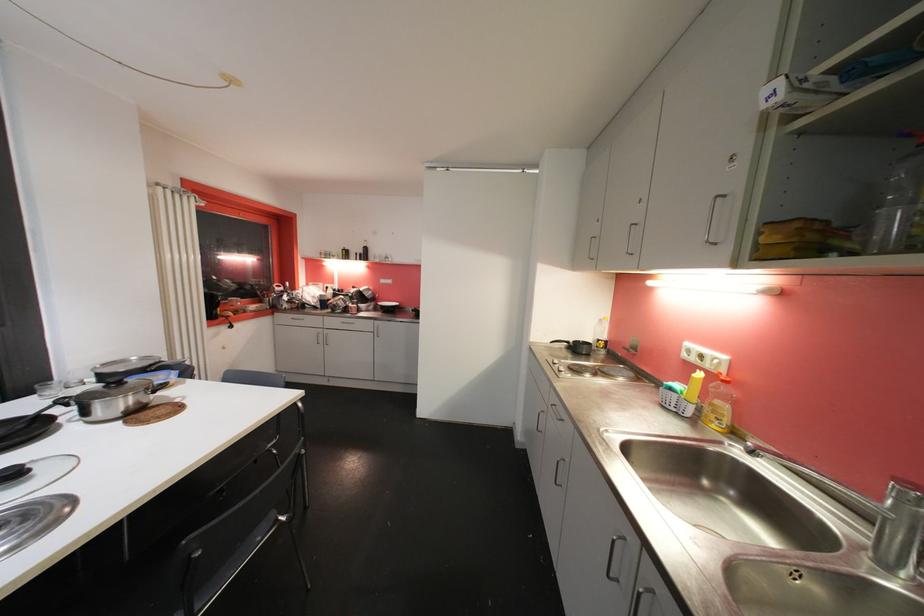
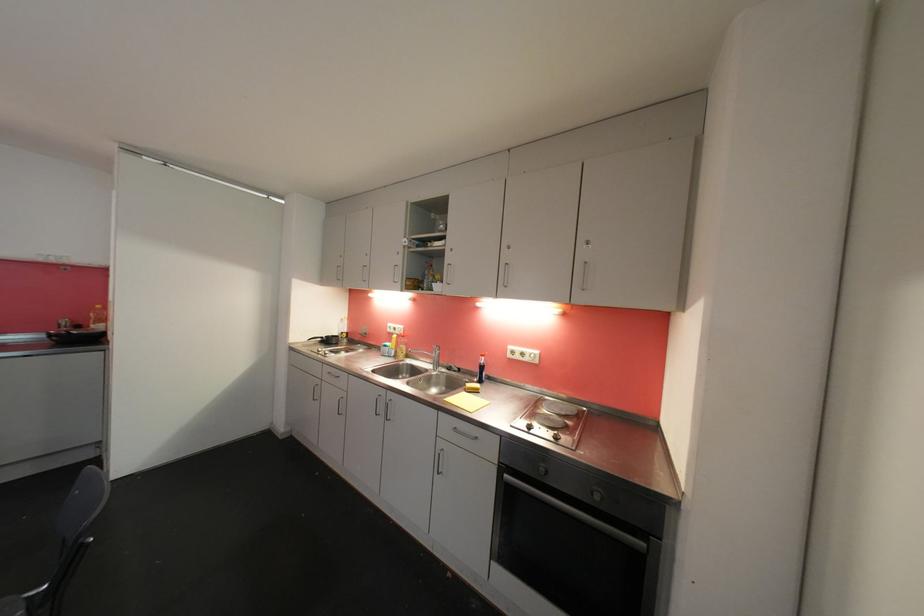
Locate, in the second image, the point that corresponds to pixel 563 405 in the first image.

(336, 371)